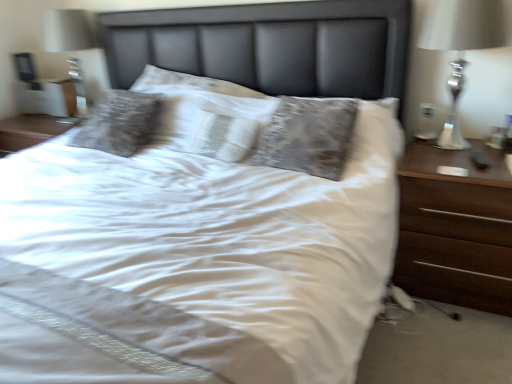
Question: From a real-world perspective, is silver metallic lamp at right above or below white textured pillow at center?

Choices:
 (A) above
 (B) below

Answer: (A)

Question: Would you say silver metallic lamp at right is inside or outside white textured pillow at center?

Choices:
 (A) outside
 (B) inside

Answer: (A)

Question: Estimate the real-world distances between objects in this image. Which object is farther from the silver metallic lamp at right?

Choices:
 (A) dark wood nightstand at right
 (B) white textured pillow at center

Answer: (B)

Question: Which is farther from the dark wood nightstand at right?

Choices:
 (A) white textured pillow at center
 (B) silver metallic lamp at right

Answer: (A)